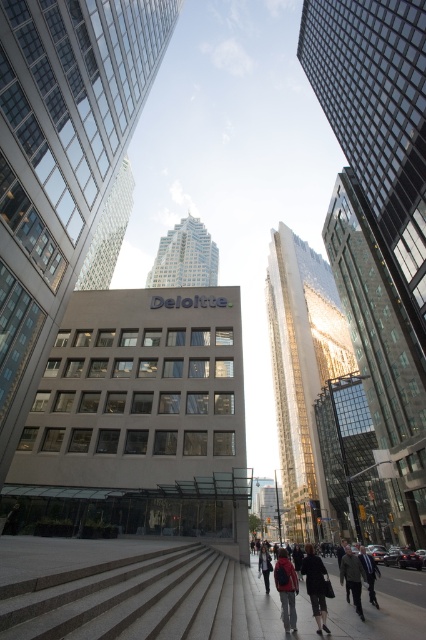
You are a delivery person standing at the entrance of the Deloitte building. You need to place a package on the gray concrete pavement at center and the dark gray sweater at center. Which surface is wider?

The gray concrete pavement at center is wider than the dark gray sweater at center, so the package should be placed on the gray concrete pavement at center.

You are standing in the middle of the bustling urban scene and notice the gray concrete pavement at center and the dark gray sweater at center. Which object occupies a larger area in the image?

The gray concrete pavement at center is bigger than the dark gray sweater at center, so the gray concrete pavement at center occupies a larger area in the image.